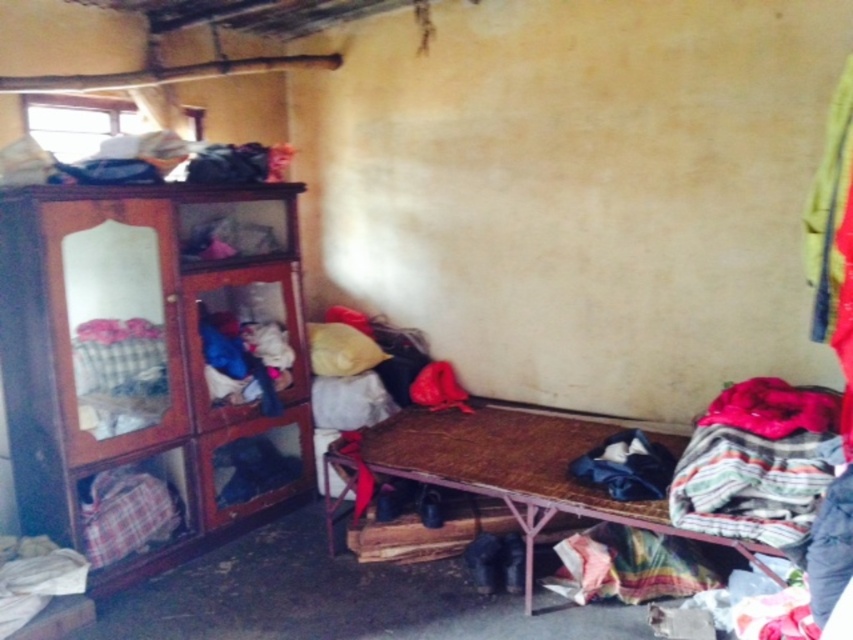
Question: Can you confirm if wooden wardrobe at left is positioned to the left of rustic wooden bed at lower right?

Choices:
 (A) yes
 (B) no

Answer: (A)

Question: Where is rustic wooden bed at lower right located in relation to plush fabric laundry at upper left in the image?

Choices:
 (A) right
 (B) left

Answer: (A)

Question: Among these points, which one is nearest to the camera?

Choices:
 (A) (54, 364)
 (B) (274, 154)

Answer: (A)

Question: From the image, what is the correct spatial relationship of wooden wardrobe at left in relation to rustic wooden bed at lower right?

Choices:
 (A) right
 (B) left

Answer: (B)

Question: Which object is the farthest from the rustic wooden bed at lower right?

Choices:
 (A) plush fabric laundry at upper left
 (B) wooden wardrobe at left

Answer: (A)

Question: Which object is positioned closest to the plush fabric laundry at upper left?

Choices:
 (A) rustic wooden bed at lower right
 (B) wooden wardrobe at left

Answer: (B)